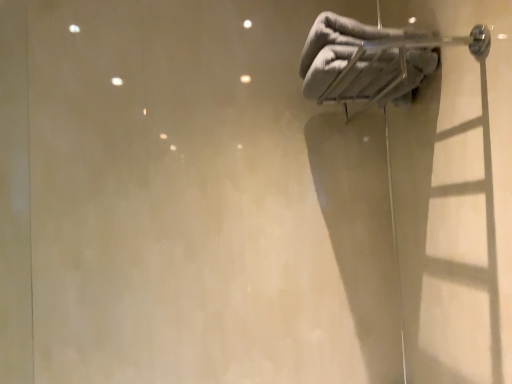
Where is `white soft towel at upper right`? white soft towel at upper right is located at coordinates (334, 49).

This screenshot has height=384, width=512. Describe the element at coordinates (334, 49) in the screenshot. I see `white soft towel at upper right` at that location.

Locate an element on the screen. The width and height of the screenshot is (512, 384). white soft towel at upper right is located at coordinates (334, 49).